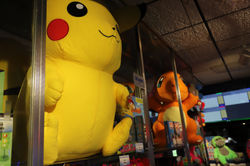
This screenshot has width=250, height=166. Find the location of `ceiling tile`. ceiling tile is located at coordinates (206, 40).